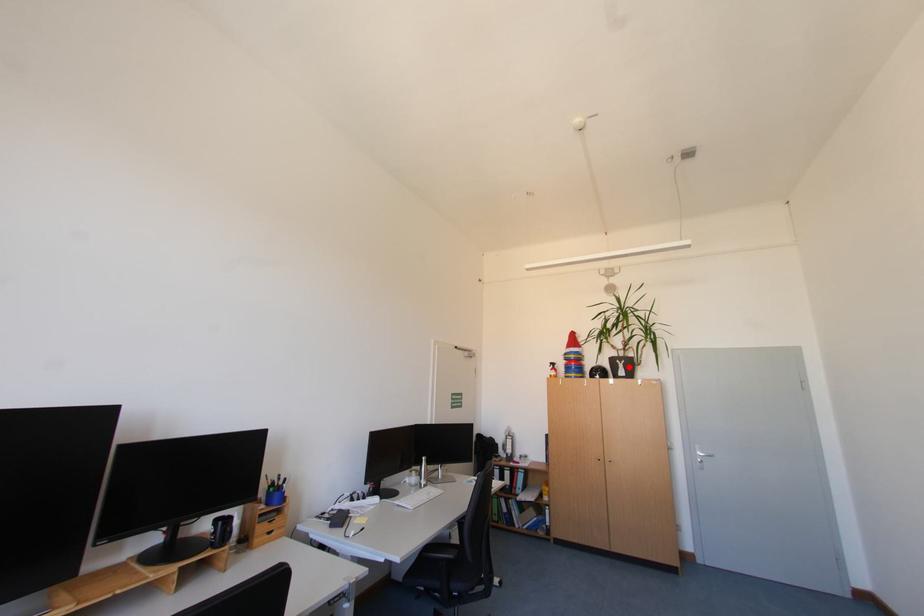
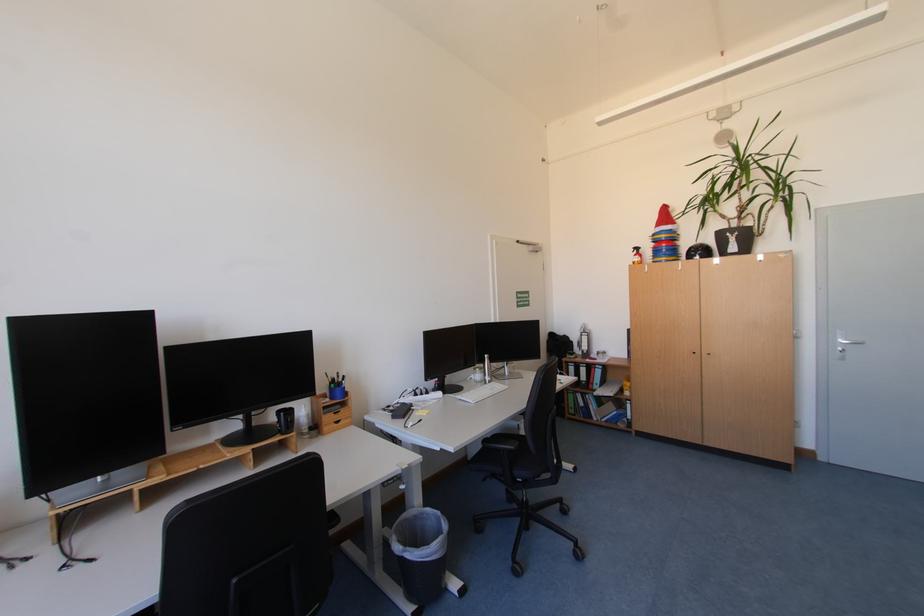
Locate, in the second image, the point that corresponds to the highlighted location in the first image.

(739, 241)